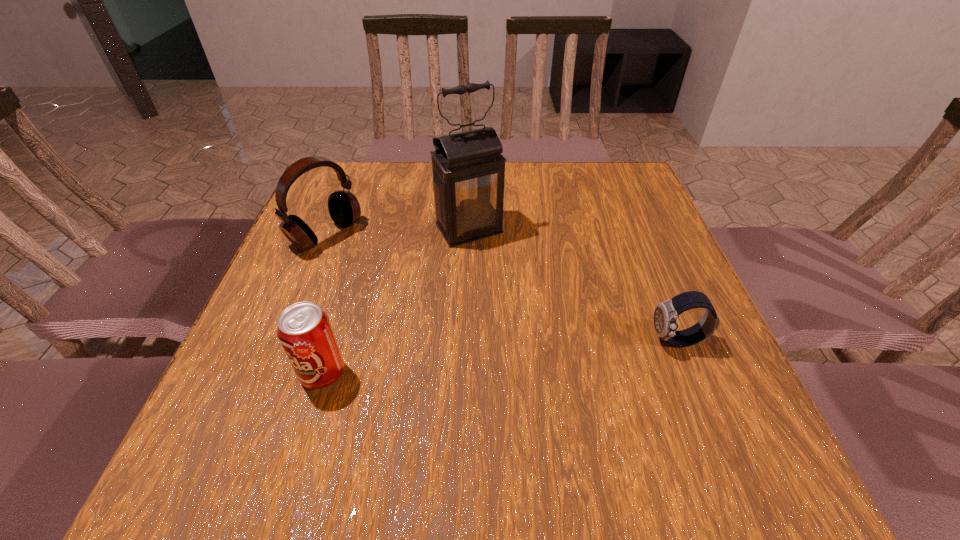
In order to click on vacant space on the desktop that is between the soda and the watch and is positioned on the front-facing side of the third object from left to right in this screenshot , I will do `click(553, 353)`.

Locate an element on the screen. The image size is (960, 540). vacant space on the desktop that is between the soda and the watch and is positioned on the ear pads of the headset is located at coordinates click(507, 356).